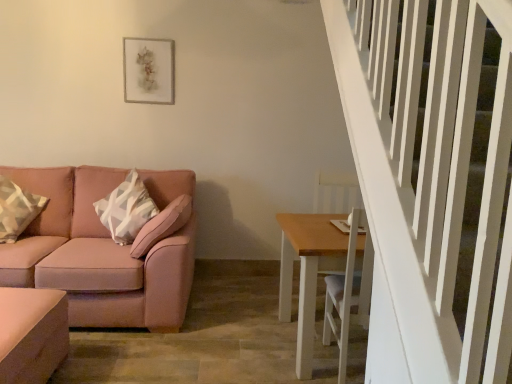
Question: Looking at the image, does matte pink ottoman at lower left, which is the second table from right to left, seem bigger or smaller compared to geometric-patterned fabric pillow at left?

Choices:
 (A) small
 (B) big

Answer: (B)

Question: Looking at their shapes, would you say matte pink ottoman at lower left, the 1th table positioned from the left, is wider or thinner than geometric-patterned fabric pillow at left?

Choices:
 (A) wide
 (B) thin

Answer: (A)

Question: Estimate the real-world distances between objects in this image. Which object is closer to the matte pink ottoman at lower left, which is the second table from right to left?

Choices:
 (A) pink fabric couch at left
 (B) matte gray picture frame at upper center
 (C) geometric-patterned fabric pillow at left
 (D) light brown wooden table at lower right, which is the second table from left to right

Answer: (A)

Question: Which object is the farthest from the geometric-patterned fabric pillow at left?

Choices:
 (A) pink fabric couch at left
 (B) light brown wooden table at lower right, acting as the 1th table starting from the right
 (C) matte gray picture frame at upper center
 (D) matte pink ottoman at lower left, the 1th table positioned from the left

Answer: (B)